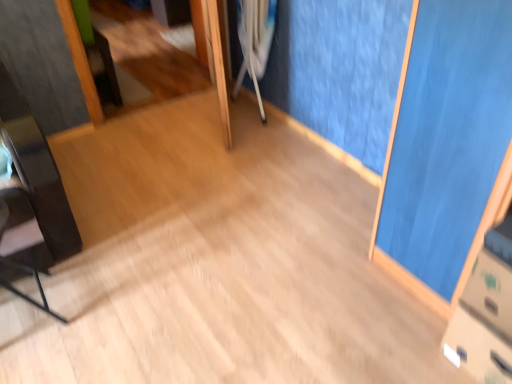
At what (x,y) coordinates should I click in order to perform the action: click on vacant region to the left of white plastic crutch at center. Please return your answer as a coordinate pair (x, y). This screenshot has width=512, height=384. Looking at the image, I should click on (213, 112).